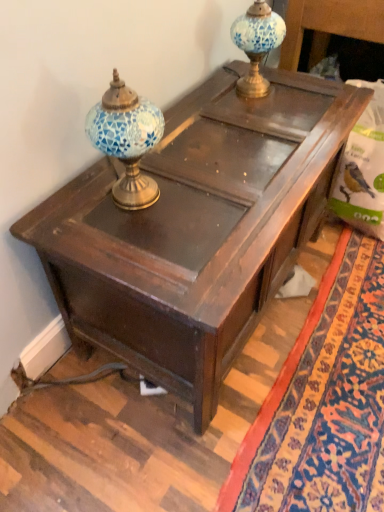
The width and height of the screenshot is (384, 512). I want to click on blue mosaic glass lamp at upper left, which is counted as the 2th candle holder, starting from the right, so click(127, 140).

This screenshot has height=512, width=384. I want to click on blue mosaic glass lamp at upper center, the first candle holder positioned from the top, so click(257, 44).

The width and height of the screenshot is (384, 512). Describe the element at coordinates (196, 229) in the screenshot. I see `wooden table at center` at that location.

Find the location of a particular element. blue mosaic glass lamp at upper left, the 2th candle holder from the back is located at coordinates (127, 140).

Are blue mosaic glass lamp at upper center, placed as the second candle holder when sorted from left to right, and wooden table at center far apart?

Result: They are positioned close to each other.

Locate an element on the screen. This screenshot has width=384, height=512. candle holder on the right of wooden table at center is located at coordinates (257, 44).

Considering the positions of objects blue mosaic glass lamp at upper center, the first candle holder when ordered from right to left, and wooden table at center in the image provided, who is more to the left, blue mosaic glass lamp at upper center, the first candle holder when ordered from right to left, or wooden table at center?

wooden table at center is more to the left.

Based on the photo, is blue mosaic glass lamp at upper center, the first candle holder when ordered from right to left, at the back of blue mosaic glass lamp at upper left, the 2th candle holder from the back?

No.

Is point (147, 131) farther from viewer compared to point (258, 44)?

That is False.

Who is more distant, blue mosaic glass lamp at upper left, placed as the first candle holder when sorted from bottom to top, or blue mosaic glass lamp at upper center, acting as the 2th candle holder starting from the bottom?

blue mosaic glass lamp at upper center, acting as the 2th candle holder starting from the bottom, is more distant.

Considering the relative positions of blue mosaic glass lamp at upper left, which is counted as the 2th candle holder, starting from the right, and blue mosaic glass lamp at upper center, the first candle holder positioned from the top, in the image provided, is blue mosaic glass lamp at upper left, which is counted as the 2th candle holder, starting from the right, to the left of blue mosaic glass lamp at upper center, the first candle holder positioned from the top, from the viewer's perspective?

Yes, blue mosaic glass lamp at upper left, which is counted as the 2th candle holder, starting from the right, is to the left of blue mosaic glass lamp at upper center, the first candle holder positioned from the top.

Considering the relative positions of blue mosaic glass lamp at upper center, the first candle holder when ordered from right to left, and blue mosaic glass lamp at upper left, the first candle holder viewed from the left, in the image provided, is blue mosaic glass lamp at upper center, the first candle holder when ordered from right to left, to the right of blue mosaic glass lamp at upper left, the first candle holder viewed from the left, from the viewer's perspective?

Yes, blue mosaic glass lamp at upper center, the first candle holder when ordered from right to left, is to the right of blue mosaic glass lamp at upper left, the first candle holder viewed from the left.

Considering the sizes of objects blue mosaic glass lamp at upper center, acting as the 1th candle holder starting from the back, and blue mosaic glass lamp at upper left, placed as the first candle holder when sorted from bottom to top, in the image provided, who is thinner, blue mosaic glass lamp at upper center, acting as the 1th candle holder starting from the back, or blue mosaic glass lamp at upper left, placed as the first candle holder when sorted from bottom to top,?

blue mosaic glass lamp at upper left, placed as the first candle holder when sorted from bottom to top.

From the picture: Can you confirm if blue mosaic glass lamp at upper center, the first candle holder positioned from the top, is smaller than blue mosaic glass lamp at upper left, which is counted as the 2th candle holder, starting from the right?

Correct, blue mosaic glass lamp at upper center, the first candle holder positioned from the top, occupies less space than blue mosaic glass lamp at upper left, which is counted as the 2th candle holder, starting from the right.

From a real-world perspective, is blue mosaic glass lamp at upper center, the 2th candle holder viewed from the front, positioned above or below blue mosaic glass lamp at upper left, placed as the first candle holder when sorted from bottom to top?

From a real-world perspective, blue mosaic glass lamp at upper center, the 2th candle holder viewed from the front, is physically below blue mosaic glass lamp at upper left, placed as the first candle holder when sorted from bottom to top.

Considering the relative sizes of wooden table at center and blue mosaic glass lamp at upper left, the 2th candle holder from the back, in the image provided, is wooden table at center shorter than blue mosaic glass lamp at upper left, the 2th candle holder from the back,?

Answer: In fact, wooden table at center may be taller than blue mosaic glass lamp at upper left, the 2th candle holder from the back.

From a real-world perspective, which is physically below, wooden table at center or blue mosaic glass lamp at upper left, which is counted as the 2th candle holder, starting from the right?

A: wooden table at center.

Is point (194, 194) positioned behind point (114, 78)?

Yes, point (194, 194) is behind point (114, 78).

Is wooden table at center not near blue mosaic glass lamp at upper left, the first candle holder viewed from the left?

That's not correct — wooden table at center is a little close to blue mosaic glass lamp at upper left, the first candle holder viewed from the left.

From the picture: Is blue mosaic glass lamp at upper left, placed as the first candle holder when sorted from bottom to top, not within wooden table at center?

Absolutely, blue mosaic glass lamp at upper left, placed as the first candle holder when sorted from bottom to top, is external to wooden table at center.

Is wooden table at center at the back of blue mosaic glass lamp at upper left, which is counted as the 2th candle holder, starting from the right?

No.

From the image's perspective, is blue mosaic glass lamp at upper left, placed as the first candle holder when sorted from bottom to top, above wooden table at center?

Correct, blue mosaic glass lamp at upper left, placed as the first candle holder when sorted from bottom to top, appears higher than wooden table at center in the image.

From a real-world perspective, does blue mosaic glass lamp at upper left, placed as the first candle holder when sorted from bottom to top, stand above wooden table at center?

Yes, from a real-world perspective, blue mosaic glass lamp at upper left, placed as the first candle holder when sorted from bottom to top, is on top of wooden table at center.

From the image's perspective, which one is positioned lower, wooden table at center or blue mosaic glass lamp at upper center, the first candle holder when ordered from right to left?

From the image's view, wooden table at center is below.

Is wooden table at center placed right next to blue mosaic glass lamp at upper center, acting as the 1th candle holder starting from the back?

No, wooden table at center is not making contact with blue mosaic glass lamp at upper center, acting as the 1th candle holder starting from the back.

Considering the sizes of wooden table at center and blue mosaic glass lamp at upper center, the first candle holder positioned from the top, in the image, is wooden table at center bigger or smaller than blue mosaic glass lamp at upper center, the first candle holder positioned from the top,?

Considering their sizes, wooden table at center takes up more space than blue mosaic glass lamp at upper center, the first candle holder positioned from the top.

Is wooden table at center shorter than blue mosaic glass lamp at upper center, placed as the second candle holder when sorted from left to right?

In fact, wooden table at center may be taller than blue mosaic glass lamp at upper center, placed as the second candle holder when sorted from left to right.

Find the location of a particular element. This screenshot has height=512, width=384. table in front of the blue mosaic glass lamp at upper center, acting as the 2th candle holder starting from the bottom is located at coordinates (196, 229).

Identify the location of candle holder that is on the left side of blue mosaic glass lamp at upper center, placed as the second candle holder when sorted from left to right. This screenshot has width=384, height=512. (127, 140).

Considering their positions, is wooden table at center positioned further to blue mosaic glass lamp at upper center, placed as the second candle holder when sorted from left to right, than blue mosaic glass lamp at upper left, the first candle holder viewed from the left?

blue mosaic glass lamp at upper left, the first candle holder viewed from the left.

Considering their positions, is blue mosaic glass lamp at upper left, placed as the first candle holder when sorted from bottom to top, positioned closer to blue mosaic glass lamp at upper center, the 2th candle holder viewed from the front, than wooden table at center?

Based on the image, wooden table at center appears to be nearer to blue mosaic glass lamp at upper center, the 2th candle holder viewed from the front.

Based on the photo, from the image, which object appears to be farther from wooden table at center, blue mosaic glass lamp at upper center, acting as the 1th candle holder starting from the back, or blue mosaic glass lamp at upper left, which ranks as the second candle holder in top-to-bottom order?

The object further to wooden table at center is blue mosaic glass lamp at upper center, acting as the 1th candle holder starting from the back.

Based on their spatial positions, is blue mosaic glass lamp at upper center, acting as the 1th candle holder starting from the back, or wooden table at center further from blue mosaic glass lamp at upper left, the 2th candle holder from the back?

blue mosaic glass lamp at upper center, acting as the 1th candle holder starting from the back.

Looking at the image, which one is located closer to wooden table at center, blue mosaic glass lamp at upper left, placed as the first candle holder when sorted from bottom to top, or blue mosaic glass lamp at upper center, the first candle holder positioned from the top?

blue mosaic glass lamp at upper left, placed as the first candle holder when sorted from bottom to top, lies closer to wooden table at center than the other object.

Estimate the real-world distances between objects in this image. Which object is closer to blue mosaic glass lamp at upper left, placed as the first candle holder when sorted from bottom to top, wooden table at center or blue mosaic glass lamp at upper center, placed as the second candle holder when sorted from left to right?

Among the two, wooden table at center is located nearer to blue mosaic glass lamp at upper left, placed as the first candle holder when sorted from bottom to top.

Find the location of a particular element. The image size is (384, 512). candle holder between blue mosaic glass lamp at upper center, the first candle holder when ordered from right to left, and wooden table at center, in the vertical direction is located at coordinates (127, 140).